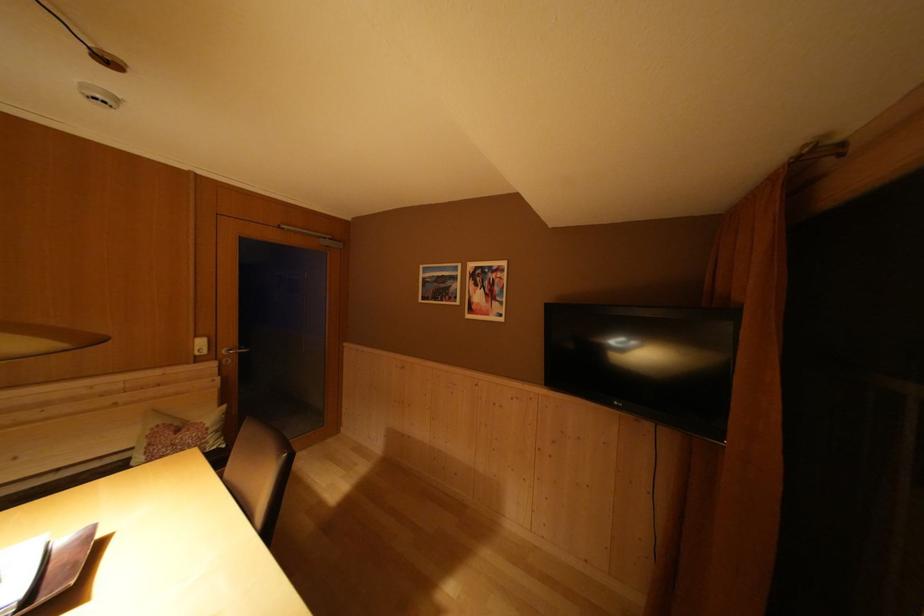
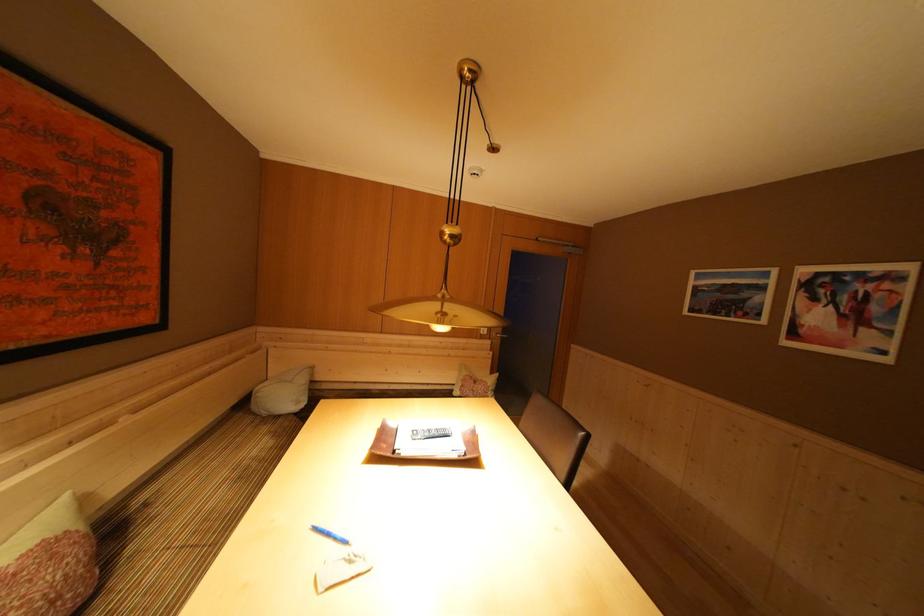
Question: The camera is either moving clockwise (left) or counter-clockwise (right) around the object. The first image is from the beginning of the video and the second image is from the end. Is the camera moving left or right when shooting the video?

Choices:
 (A) Left
 (B) Right

Answer: (B)